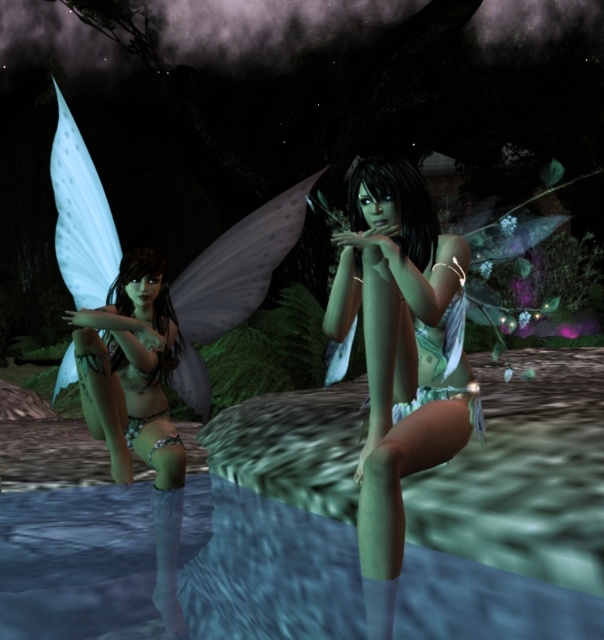
You are a fairy in the forest and you want to retrieve your green matte bikini at center from behind the translucent blue water at lower center. Can you reach it without getting your wings wet?

The green matte bikini at center is behind the translucent blue water at lower center, so you would have to move through the water to reach it, which might get your wings wet.

You are a painter observing the fairies in the nocturnal forest. You need to paint the scene accurately. Which object is positioned to the right of the other between the green matte bikini at center and the translucent white wings at left?

The green matte bikini at center is to the right of the translucent white wings at left.